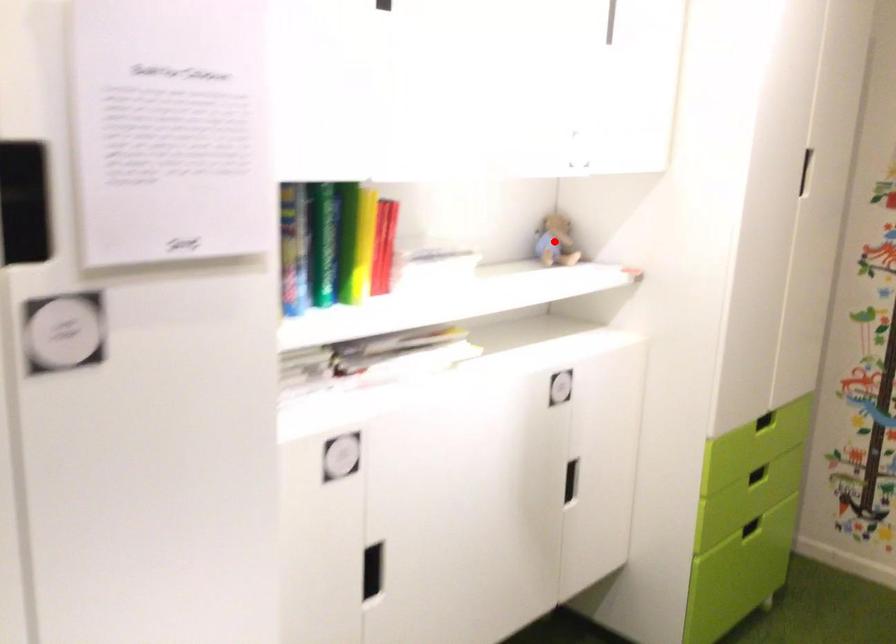
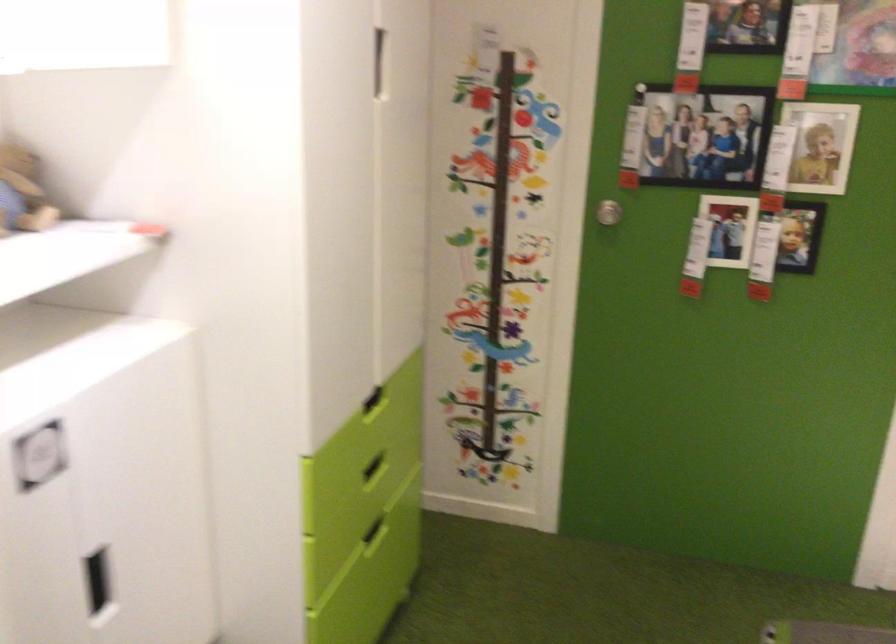
Question: I am providing you with two images of the same scene from different viewpoints. A red point is shown in image1. For the corresponding object point in image2, is it positioned nearer or farther from the camera?

Choices:
 (A) Nearer
 (B) Farther

Answer: (A)